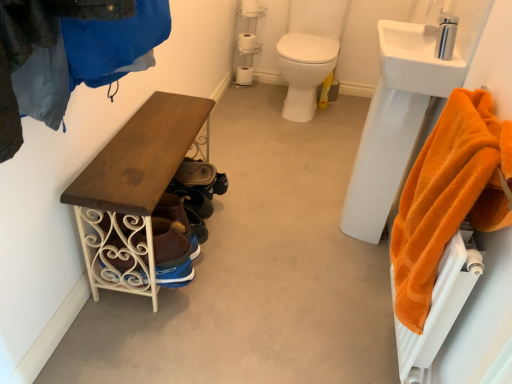
Question: Is white ceramic sink at upper right far from white glossy toilet at center?

Choices:
 (A) yes
 (B) no

Answer: (A)

Question: Is white ceramic sink at upper right looking in the opposite direction of white glossy toilet at center?

Choices:
 (A) no
 (B) yes

Answer: (A)

Question: From a real-world perspective, is white ceramic sink at upper right physically above white glossy toilet at center?

Choices:
 (A) yes
 (B) no

Answer: (A)

Question: Does white ceramic sink at upper right have a greater width compared to white glossy toilet at center?

Choices:
 (A) yes
 (B) no

Answer: (B)

Question: Can you confirm if white ceramic sink at upper right is thinner than white glossy toilet at center?

Choices:
 (A) no
 (B) yes

Answer: (B)

Question: Looking at the image, does white matte toilet paper at center, which is counted as the 1th toilet paper, starting from the back, seem bigger or smaller compared to orange plush towel at right?

Choices:
 (A) small
 (B) big

Answer: (A)

Question: From the image's perspective, is white matte toilet paper at center, which is counted as the 1th toilet paper, starting from the back, above or below orange plush towel at right?

Choices:
 (A) below
 (B) above

Answer: (B)

Question: Considering the positions of point (240, 72) and point (454, 127), is point (240, 72) closer or farther from the camera than point (454, 127)?

Choices:
 (A) closer
 (B) farther

Answer: (B)

Question: From a real-world perspective, is white matte toilet paper at center, the 3th toilet paper viewed from the top, above or below orange plush towel at right?

Choices:
 (A) below
 (B) above

Answer: (A)

Question: Relative to leather shoe at center, is white matte toilet paper at upper center, the first toilet paper in the top-to-bottom sequence, in front or behind?

Choices:
 (A) front
 (B) behind

Answer: (B)

Question: Is white matte toilet paper at upper center, the first toilet paper in the top-to-bottom sequence, taller or shorter than leather shoe at center?

Choices:
 (A) short
 (B) tall

Answer: (B)

Question: Is point (244, 1) closer or farther from the camera than point (202, 175)?

Choices:
 (A) closer
 (B) farther

Answer: (B)

Question: From a real-world perspective, is white matte toilet paper at upper center, which is the 1th toilet paper in front-to-back order, above or below leather shoe at center?

Choices:
 (A) below
 (B) above

Answer: (B)

Question: From the image's perspective, is silver metallic faucet at upper right above or below white ceramic sink at upper right?

Choices:
 (A) below
 (B) above

Answer: (A)

Question: Is silver metallic faucet at upper right inside or outside of white ceramic sink at upper right?

Choices:
 (A) outside
 (B) inside

Answer: (A)